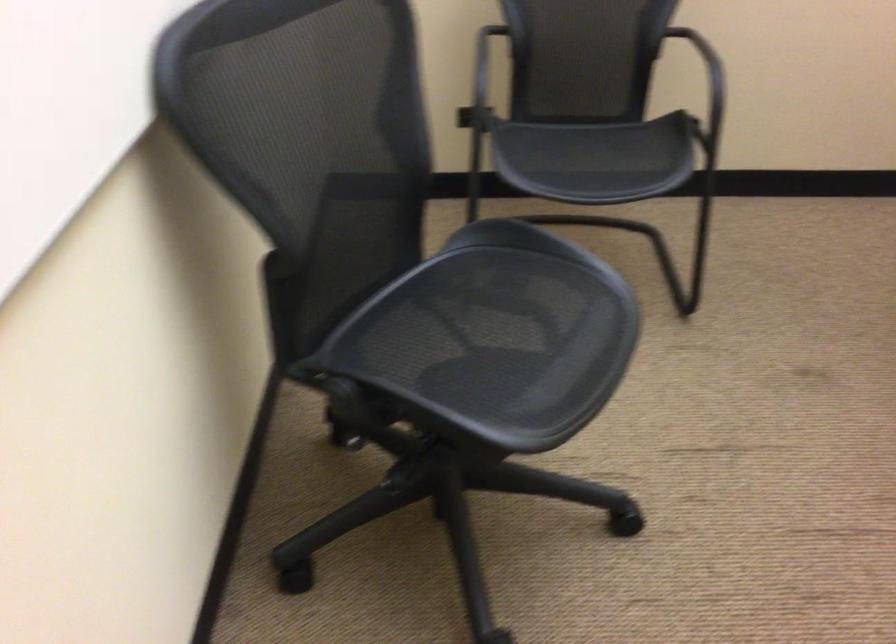
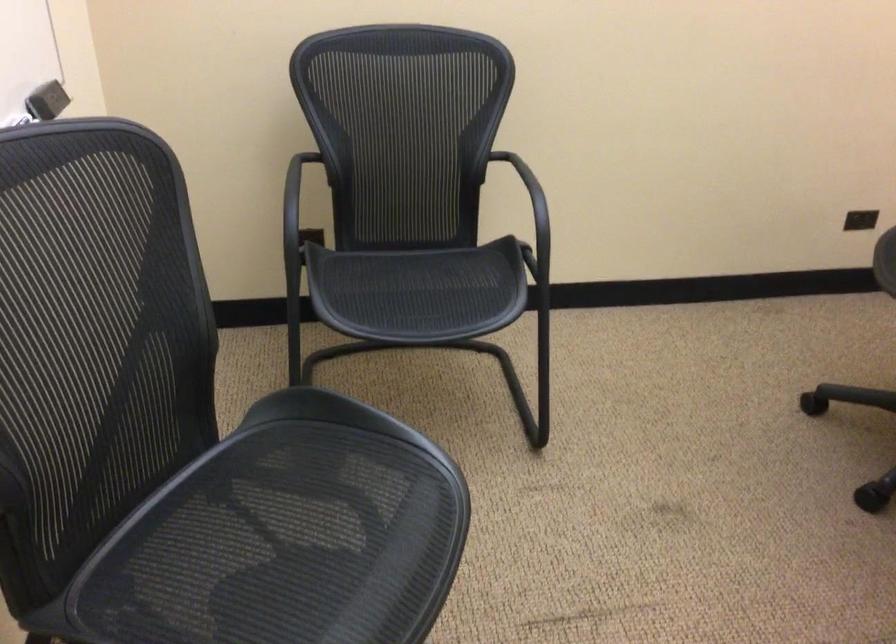
Find the pixel in the second image that matches point 468,335 in the first image.

(259, 547)